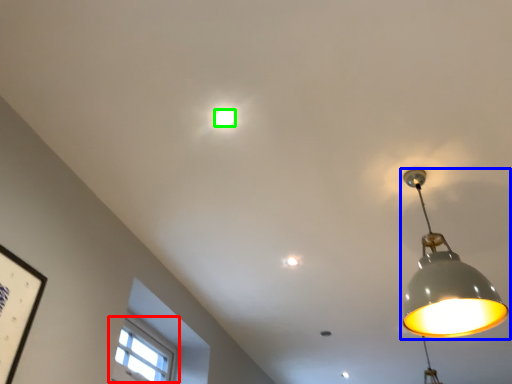
Question: Based on their relative distances, which object is nearer to window (highlighted by a red box)? Choose from lamp (highlighted by a blue box) and lamp (highlighted by a green box).

Choices:
 (A) lamp
 (B) lamp

Answer: (A)